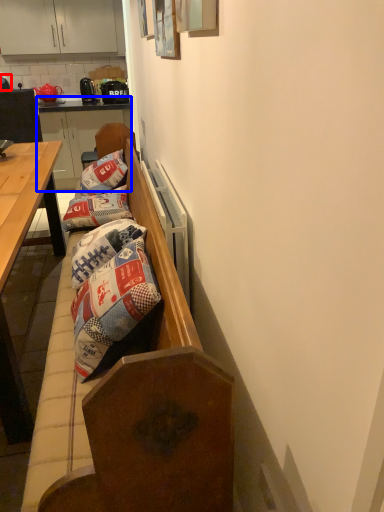
Question: Which object is further to the camera taking this photo, coffee cup (highlighted by a red box) or dresser (highlighted by a blue box)?

Choices:
 (A) coffee cup
 (B) dresser

Answer: (B)